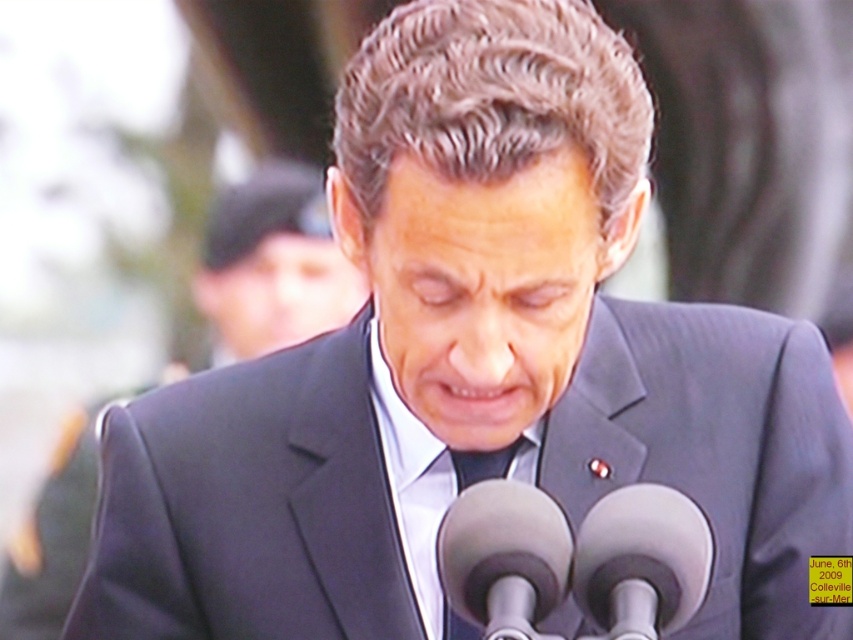
Question: Which object appears closest to the camera in this image?

Choices:
 (A) black matte suit at center
 (B) gray metallic microphone at center
 (C) smooth gray microphone at center

Answer: (B)

Question: Observing the image, what is the correct spatial positioning of gray metallic microphone at center in reference to smooth gray microphone at center?

Choices:
 (A) right
 (B) left

Answer: (A)

Question: Is black matte suit at center wider than smooth gray microphone at center?

Choices:
 (A) no
 (B) yes

Answer: (B)

Question: Estimate the real-world distances between objects in this image. Which object is farther from the black matte suit at center?

Choices:
 (A) gray metallic microphone at center
 (B) smooth gray microphone at center

Answer: (A)

Question: Which point is closer to the camera taking this photo?

Choices:
 (A) (479, 508)
 (B) (212, 268)

Answer: (A)

Question: Is gray metallic microphone at center further to the viewer compared to smooth gray microphone at center?

Choices:
 (A) yes
 (B) no

Answer: (B)